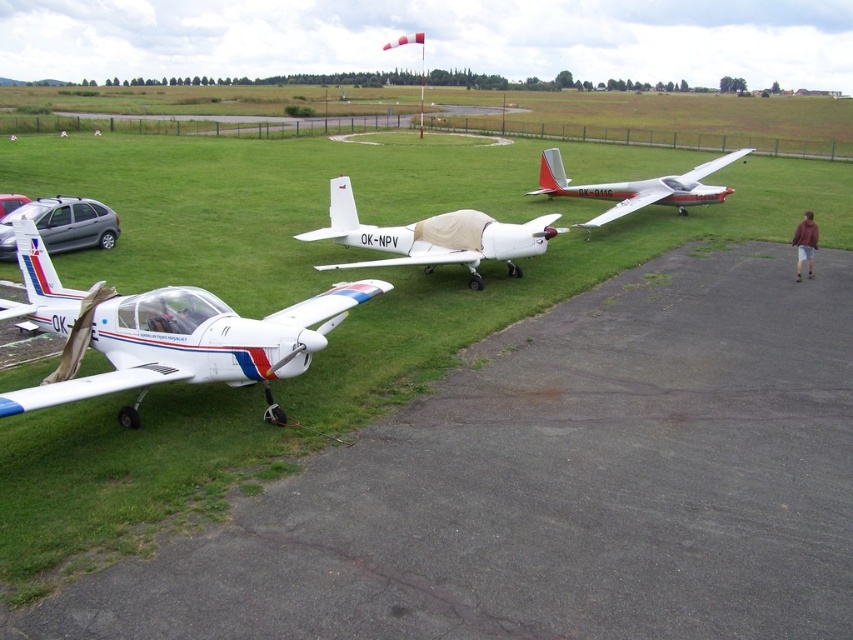
Does white matte airplane at left appear on the right side of brown fabric jacket at lower right?

In fact, white matte airplane at left is to the left of brown fabric jacket at lower right.

Is white matte airplane at left positioned at the back of brown fabric jacket at lower right?

No.

Between point (131, 310) and point (804, 259), which one is positioned in front?

Point (131, 310)

The height and width of the screenshot is (640, 853). Find the location of `white matte airplane at left`. white matte airplane at left is located at coordinates tap(167, 333).

Can you confirm if silver metallic hatchback at left is taller than silver metallic car at left?

Indeed, silver metallic hatchback at left has a greater height compared to silver metallic car at left.

Which of these two, silver metallic hatchback at left or silver metallic car at left, stands shorter?

With less height is silver metallic car at left.

Is point (82, 198) closer to viewer compared to point (0, 212)?

That is True.

You are a GUI agent. You are given a task and a screenshot of the screen. Output one action in this format:
    pyautogui.click(x=<x>, y=<y>)
    Task: Click on the silver metallic hatchback at left
    
    Given the screenshot: What is the action you would take?
    coord(62,225)

Is white matte airplane at left further to camera compared to white matte glider at center?

No, it is in front of white matte glider at center.

Does white matte airplane at left appear on the right side of white matte glider at center?

In fact, white matte airplane at left is to the left of white matte glider at center.

The image size is (853, 640). In order to click on white matte airplane at left in this screenshot , I will do `click(167, 333)`.